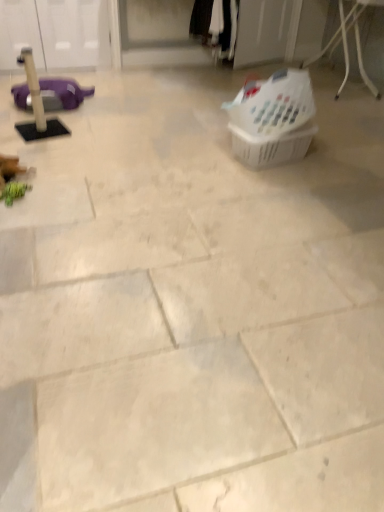
Question: Considering the relative sizes of white plastic laundry basket at upper right, the first basket viewed from the top, and metallic wire basket at upper right in the image provided, is white plastic laundry basket at upper right, the first basket viewed from the top, wider than metallic wire basket at upper right?

Choices:
 (A) no
 (B) yes

Answer: (A)

Question: Is there a large distance between white plastic laundry basket at upper right, the first basket viewed from the top, and metallic wire basket at upper right?

Choices:
 (A) no
 (B) yes

Answer: (B)

Question: Is white plastic laundry basket at upper right, the first basket viewed from the top, beside metallic wire basket at upper right?

Choices:
 (A) no
 (B) yes

Answer: (A)

Question: From a real-world perspective, is white plastic laundry basket at upper right, the first basket viewed from the top, located beneath metallic wire basket at upper right?

Choices:
 (A) no
 (B) yes

Answer: (A)

Question: From the image's perspective, would you say white plastic laundry basket at upper right, the first basket viewed from the top, is positioned over metallic wire basket at upper right?

Choices:
 (A) yes
 (B) no

Answer: (B)

Question: Considering the positions of black cotton pants at upper center and white plastic laundry basket at upper right, acting as the 2th basket starting from the bottom, in the image, is black cotton pants at upper center bigger or smaller than white plastic laundry basket at upper right, acting as the 2th basket starting from the bottom,?

Choices:
 (A) big
 (B) small

Answer: (A)

Question: Is black cotton pants at upper center taller or shorter than white plastic laundry basket at upper right, acting as the 2th basket starting from the bottom?

Choices:
 (A) tall
 (B) short

Answer: (A)

Question: Is black cotton pants at upper center to the left or to the right of white plastic laundry basket at upper right, acting as the 2th basket starting from the bottom, in the image?

Choices:
 (A) left
 (B) right

Answer: (A)

Question: Is black cotton pants at upper center spatially inside white plastic laundry basket at upper right, acting as the 2th basket starting from the bottom, or outside of it?

Choices:
 (A) outside
 (B) inside

Answer: (A)

Question: Is point (223, 23) closer or farther from the camera than point (251, 159)?

Choices:
 (A) closer
 (B) farther

Answer: (B)

Question: Considering the positions of black cotton pants at upper center and translucent plastic basket at center-right, the first basket ordered from the bottom, in the image, is black cotton pants at upper center wider or thinner than translucent plastic basket at center-right, the first basket ordered from the bottom,?

Choices:
 (A) wide
 (B) thin

Answer: (A)

Question: From the image's perspective, relative to translucent plastic basket at center-right, the first basket ordered from the bottom, is black cotton pants at upper center above or below?

Choices:
 (A) below
 (B) above

Answer: (B)

Question: Is black cotton pants at upper center situated inside translucent plastic basket at center-right, the first basket ordered from the bottom, or outside?

Choices:
 (A) outside
 (B) inside

Answer: (A)

Question: Is black cotton pants at upper center situated inside metallic wire basket at upper right or outside?

Choices:
 (A) inside
 (B) outside

Answer: (B)

Question: Is black cotton pants at upper center taller or shorter than metallic wire basket at upper right?

Choices:
 (A) tall
 (B) short

Answer: (B)